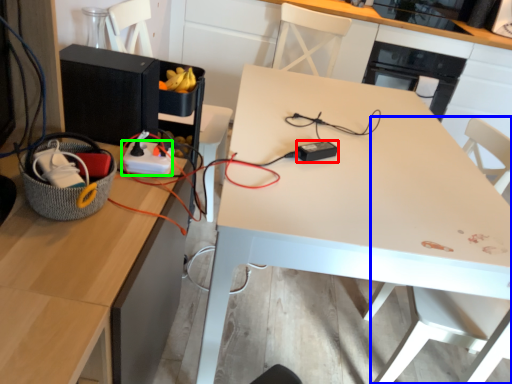
Question: Which is nearer to the appliance (highlighted by a red box)? swivel chair (highlighted by a blue box) or extension cord (highlighted by a green box).

Choices:
 (A) swivel chair
 (B) extension cord

Answer: (B)